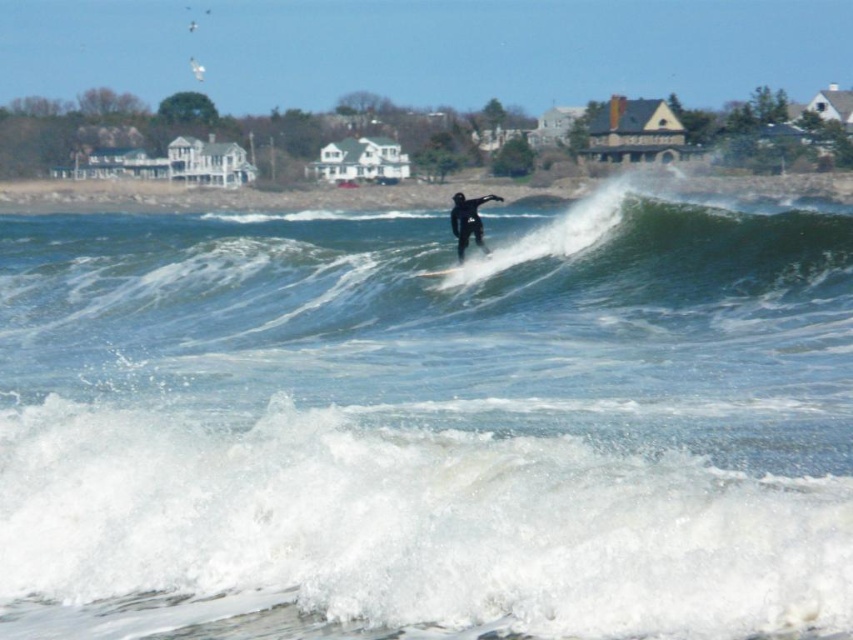
You are standing on the beach and see two points in the water. The first point is at coordinates point (706,294) and the second is at point (428,273). Which point is closer to you?

Point (706,294) is in front of point (428,273), so the first point is closer to you.

You are a photographer trying to capture the surfer in action. You notice the black matte wetsuit at center and the smooth black surfboard at center. Which object appears bigger in your photo?

The black matte wetsuit at center appears bigger in the photo because it has a larger size compared to the smooth black surfboard at center.